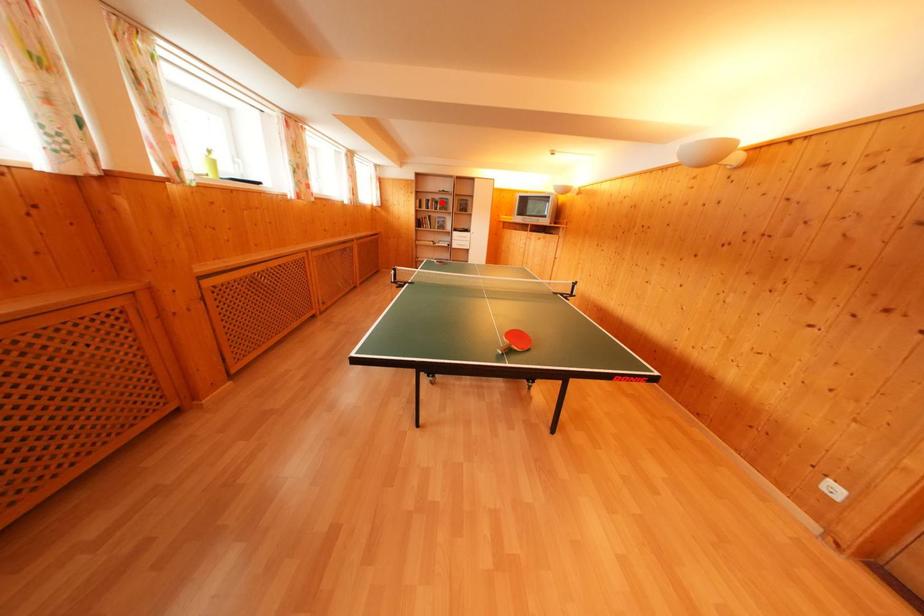
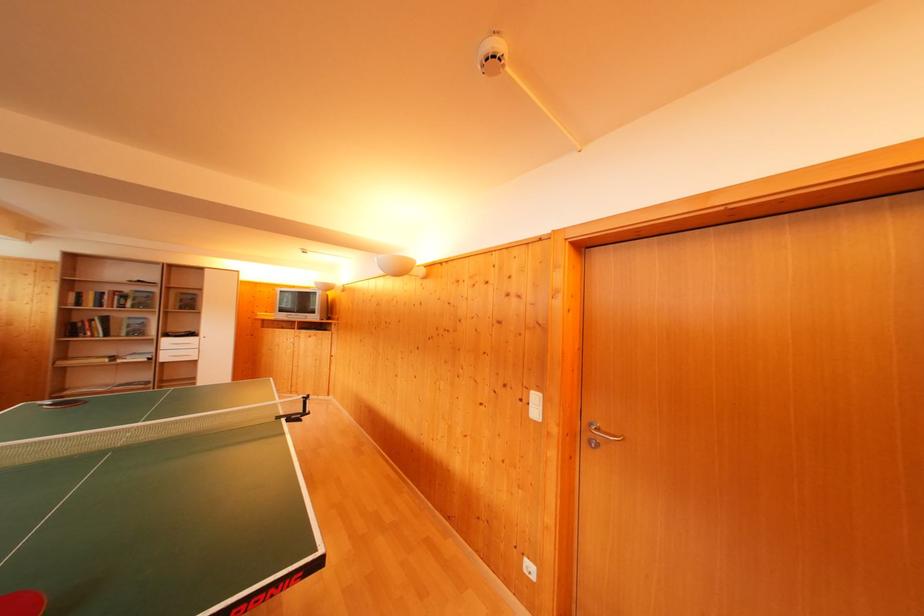
In the second image, find the point that corresponds to the highlighted location in the first image.

(131, 294)